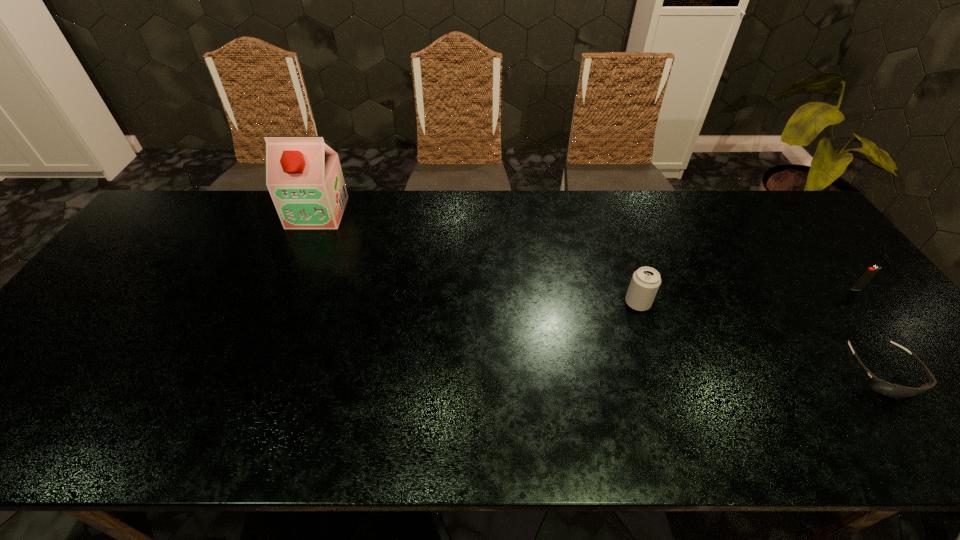
This screenshot has width=960, height=540. What are the coordinates of `vacant space that satisfies the following two spatial constraints: 1. with the cap open on the tallest object; 2. on the left side of the igniter` in the screenshot? It's located at (286, 289).

Identify the location of free location that satisfies the following two spatial constraints: 1. with the cap open on the third object from right to left; 2. on the left side of the soya milk. Image resolution: width=960 pixels, height=540 pixels. (280, 303).